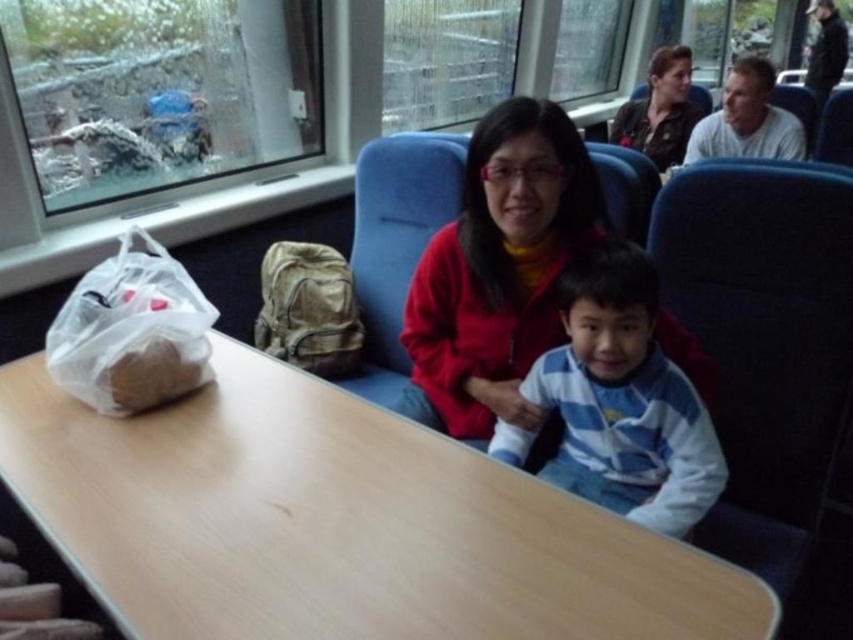
Consider the image. You are a passenger sitting at the back of the train and want to reach the light brown wood table at center to get a snack. Which direction should you move relative to the matte red jacket at center?

The light brown wood table at center is to the left of the matte red jacket at center, so you should move to the left relative to the matte red jacket at center to reach the table.

You are a passenger sitting in the train carriage and want to place your clear plastic bag at lower left on the light brown wood table at center. Can you easily reach the table from your current position?

The light brown wood table at center is closer to the viewer than clear plastic bag at lower left, so you can easily reach the table from your current position.